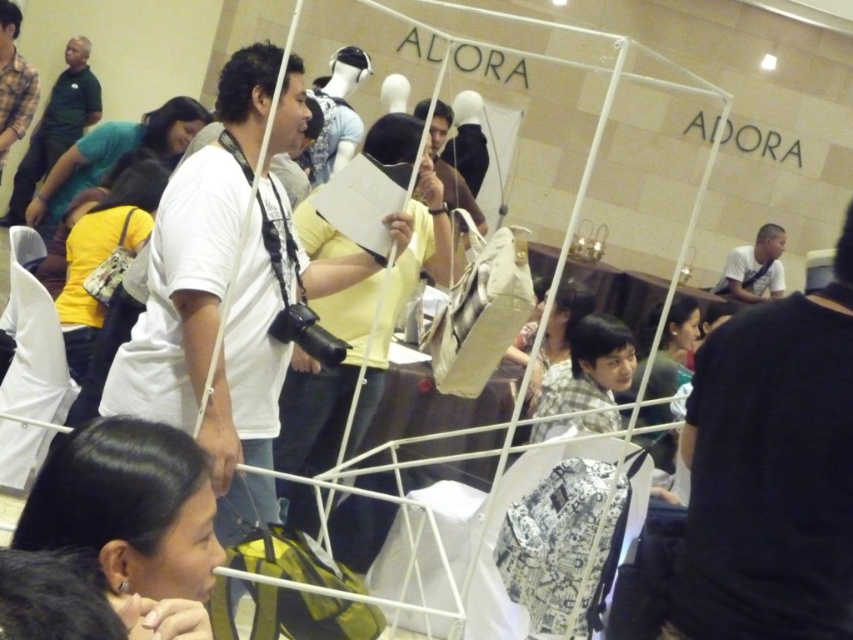
You are a photographer trying to capture a clear shot of the white shirt at center and the black hair at lower left. Which object should you focus on first if you want to ensure both are in focus without adjusting your camera settings?

The black hair at lower left is thinner than the white shirt at center, so focusing on the white shirt at center first would be better because it is larger and easier to target, ensuring both objects remain in focus.

You are a photographer at the event and want to capture a photo where both the black hair at lower left and the white shirt at center are visible. Based on their positions, which one should you focus on first to ensure both are in frame?

Since the black hair at lower left is below the white shirt at center, you should focus on the white shirt at center first to ensure both are in frame.